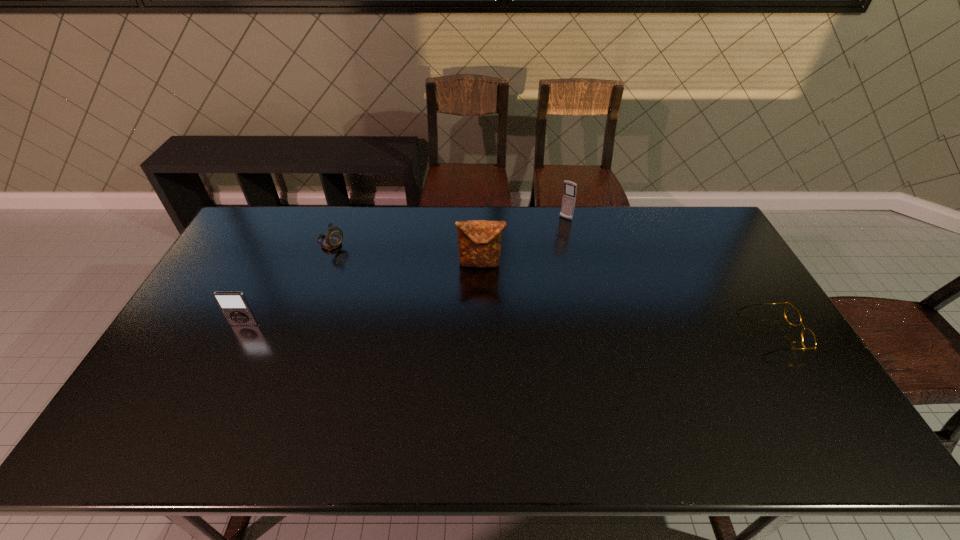
Identify the location of vacant space on the desktop that is between the leftmost object and the spectacles and is positioned on the front-facing side of the farthest object. The width and height of the screenshot is (960, 540). coord(477,328).

At what (x,y) coordinates should I click in order to perform the action: click on free space on the desktop that is between the iPod and the shortest object and is positioned on the open side of the third object from left to right. Please return your answer as a coordinate pair (x, y). The width and height of the screenshot is (960, 540). Looking at the image, I should click on (470, 328).

Identify the location of vacant space on the desktop that is between the leftmost object and the spectacles and is positioned on the face of the fourth tallest object. The width and height of the screenshot is (960, 540). (474, 328).